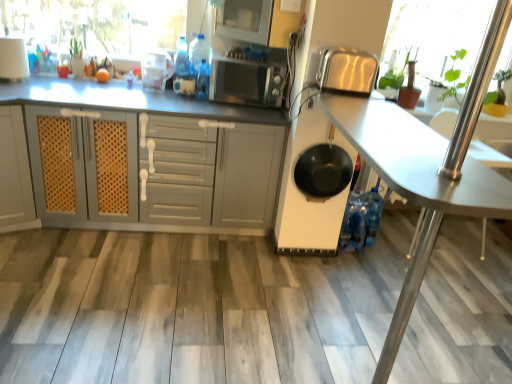
Find the location of a particular element. Image resolution: width=512 pixels, height=384 pixels. free space that is in between metallic silver table at center and white matte cabinet at center is located at coordinates (160, 302).